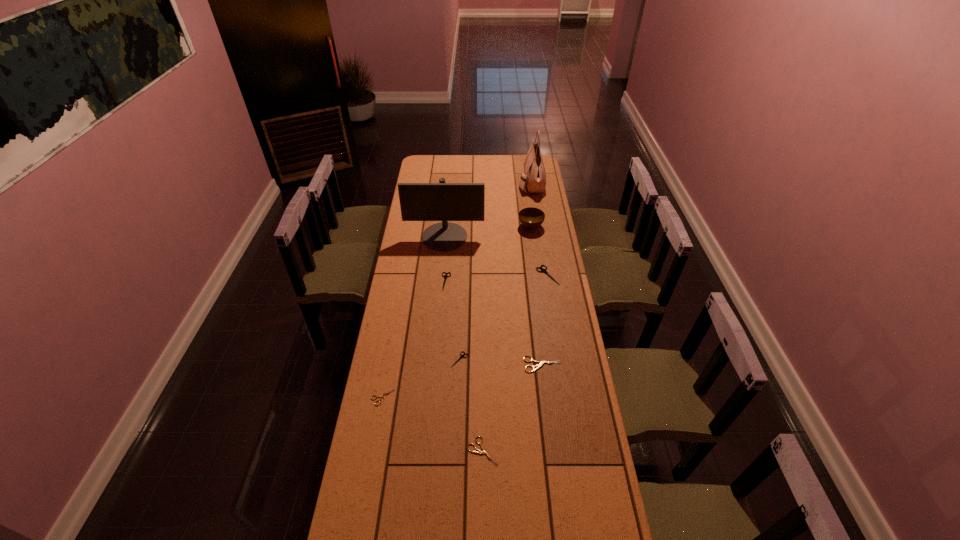
What are the coordinates of `bowl that is at the right edge` in the screenshot? It's located at (531, 218).

Where is `object present at the far right corner`? The height and width of the screenshot is (540, 960). object present at the far right corner is located at coordinates (534, 177).

Locate an element on the screen. The height and width of the screenshot is (540, 960). vacant space at the far edge of the desktop is located at coordinates (496, 160).

Locate an element on the screen. vacant space at the left edge of the desktop is located at coordinates (428, 273).

In order to click on vacant space at the right edge of the desktop in this screenshot , I will do `click(555, 310)`.

I want to click on vacant space that's between the third tallest object and the farthest beige shears, so click(x=537, y=295).

You are a GUI agent. You are given a task and a screenshot of the screen. Output one action in this format:
    pyautogui.click(x=<x>, y=<y>)
    Task: Click on the vacant area that lies between the second black shears from left to right and the second shears from left to right
    
    Given the screenshot: What is the action you would take?
    pyautogui.click(x=453, y=321)

You are a GUI agent. You are given a task and a screenshot of the screen. Output one action in this format:
    pyautogui.click(x=<x>, y=<y>)
    Task: Click on the free spot between the tallest shears and the handbag
    The height and width of the screenshot is (540, 960).
    Given the screenshot: What is the action you would take?
    pyautogui.click(x=540, y=229)

Identify the location of vacant area between the handbag and the second black shears from left to right. The width and height of the screenshot is (960, 540). (495, 271).

Identify the location of vacant region between the third tallest object and the biggest black shears. [540, 251].